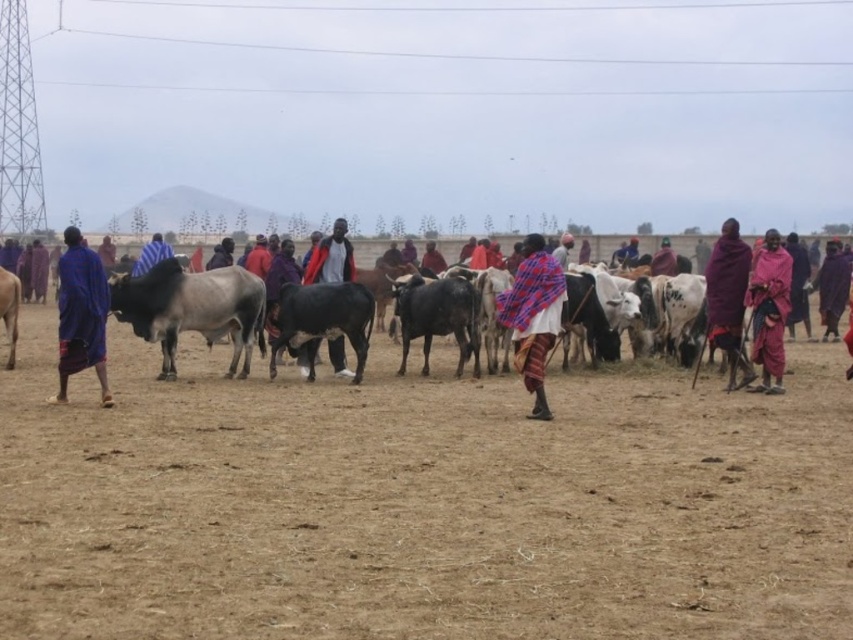
Describe the element at coordinates (422, 502) in the screenshot. This screenshot has width=853, height=640. I see `brown sandy dirt at center` at that location.

Between brown sandy dirt at center and blue fabric person at center, which one has more height?

Standing taller between the two is blue fabric person at center.

At what (x,y) coordinates should I click in order to perform the action: click on brown sandy dirt at center. Please return your answer as a coordinate pair (x, y). The width and height of the screenshot is (853, 640). Looking at the image, I should click on (422, 502).

Who is more distant from viewer, (77, 296) or (422, 368)?

Positioned behind is point (422, 368).

What do you see at coordinates (80, 316) in the screenshot? I see `blue woven cloth at left` at bounding box center [80, 316].

Image resolution: width=853 pixels, height=640 pixels. I want to click on blue woven cloth at left, so click(x=80, y=316).

Does brown sandy dirt at center have a greater height compared to white cotton shirt at center?

No, brown sandy dirt at center is not taller than white cotton shirt at center.

This screenshot has height=640, width=853. I want to click on brown sandy dirt at center, so click(x=422, y=502).